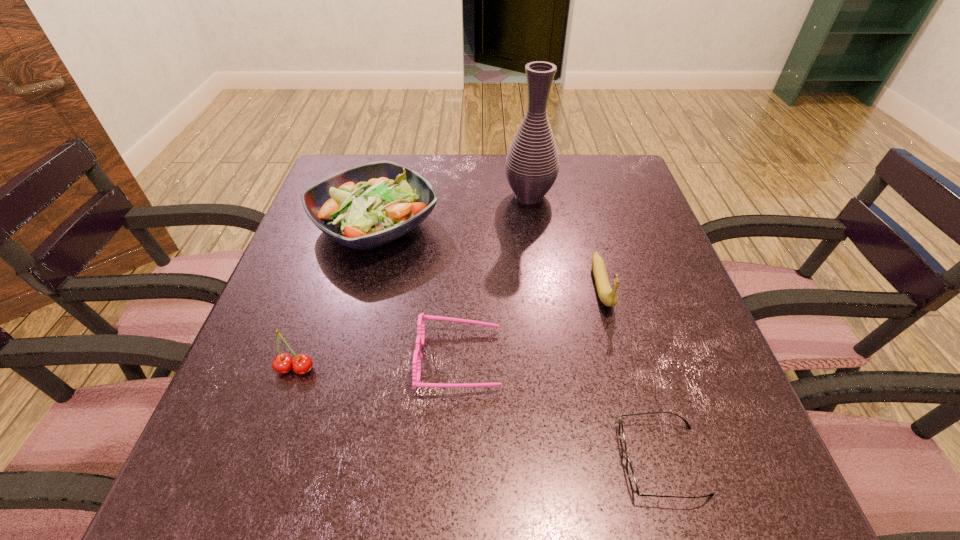
This screenshot has height=540, width=960. In order to click on blank space at the near left corner of the desktop in this screenshot , I will do `click(219, 475)`.

In the image, there is a desktop. Where is `free space at the far right corner`? This screenshot has width=960, height=540. free space at the far right corner is located at coordinates (636, 198).

Find the location of a particular element. Image resolution: width=960 pixels, height=540 pixels. vacant point located between the fifth tallest object and the shorter spectacles is located at coordinates (561, 410).

Where is `free space between the banana and the shortest object`? Image resolution: width=960 pixels, height=540 pixels. free space between the banana and the shortest object is located at coordinates (632, 373).

This screenshot has width=960, height=540. In order to click on free space that is in between the second shortest object and the salad plate in this screenshot , I will do `click(418, 292)`.

Where is `vacant space that is in between the salad plate and the cherry`? This screenshot has width=960, height=540. vacant space that is in between the salad plate and the cherry is located at coordinates (335, 297).

What are the coordinates of `free space between the cherry and the second shortest object` in the screenshot? It's located at (378, 364).

Locate an element on the screen. The width and height of the screenshot is (960, 540). empty space between the right spectacles and the tallest object is located at coordinates (595, 328).

Identify the location of empty location between the tallest object and the salad plate. The width and height of the screenshot is (960, 540). (452, 210).

Where is `free spot between the banana and the farther spectacles`? The width and height of the screenshot is (960, 540). free spot between the banana and the farther spectacles is located at coordinates (531, 322).